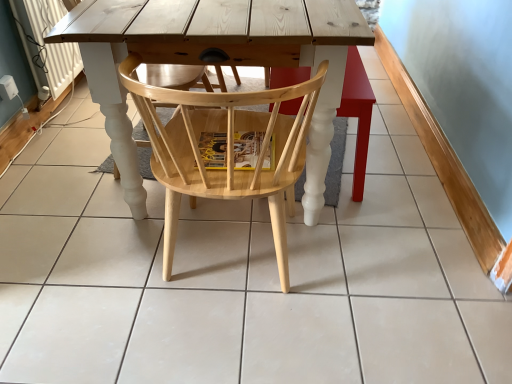
Question: Is natural wood chair at center shorter than wooden chair at center?

Choices:
 (A) no
 (B) yes

Answer: (A)

Question: Is natural wood chair at center further to camera compared to wooden chair at center?

Choices:
 (A) yes
 (B) no

Answer: (B)

Question: Would you consider natural wood chair at center to be distant from wooden chair at center?

Choices:
 (A) yes
 (B) no

Answer: (B)

Question: Does natural wood chair at center have a greater height compared to wooden chair at center?

Choices:
 (A) no
 (B) yes

Answer: (B)

Question: From a real-world perspective, is natural wood chair at center located higher than wooden chair at center?

Choices:
 (A) no
 (B) yes

Answer: (B)

Question: Does natural wood chair at center lie in front of wooden chair at center?

Choices:
 (A) no
 (B) yes

Answer: (B)

Question: Is wooden chair at center shorter than natural wood chair at center?

Choices:
 (A) yes
 (B) no

Answer: (A)

Question: Is natural wood chair at center at the back of wooden chair at center?

Choices:
 (A) no
 (B) yes

Answer: (A)

Question: Does wooden chair at center turn towards natural wood chair at center?

Choices:
 (A) no
 (B) yes

Answer: (A)

Question: From the image's perspective, is wooden chair at center located beneath natural wood chair at center?

Choices:
 (A) no
 (B) yes

Answer: (A)

Question: Is wooden chair at center thinner than natural wood chair at center?

Choices:
 (A) no
 (B) yes

Answer: (B)

Question: From a real-world perspective, is wooden chair at center beneath natural wood chair at center?

Choices:
 (A) no
 (B) yes

Answer: (B)

Question: Based on their positions, is wooden chair at center located to the left or right of natural wood chair at center?

Choices:
 (A) left
 (B) right

Answer: (B)